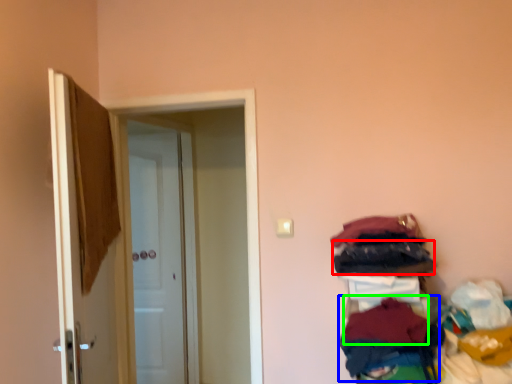
Question: Estimate the real-world distances between objects in this image. Which object is farther from clothing (highlighted by a red box), clothing (highlighted by a blue box) or clothing (highlighted by a green box)?

Choices:
 (A) clothing
 (B) clothing

Answer: (A)